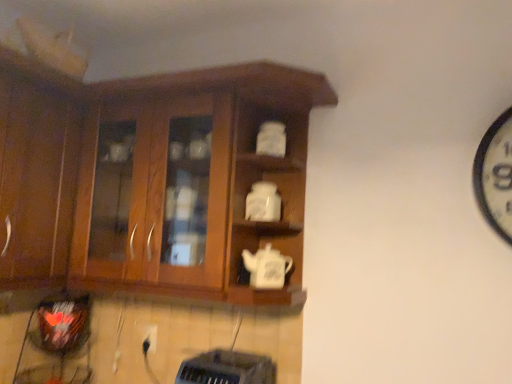
Question: Are wooden cabinet at left, arranged as the second cabinetry when viewed from the right, and white matte teapot at center, the 1th teapot from the bottom, located far from each other?

Choices:
 (A) yes
 (B) no

Answer: (B)

Question: Can you confirm if wooden cabinet at left, arranged as the second cabinetry when viewed from the right, is smaller than white matte teapot at center, the 2th teapot when ordered from top to bottom?

Choices:
 (A) no
 (B) yes

Answer: (A)

Question: Can you confirm if wooden cabinet at left, which appears as the first cabinetry when viewed from the left, is positioned to the right of white matte teapot at center, the 2th teapot when ordered from top to bottom?

Choices:
 (A) no
 (B) yes

Answer: (A)

Question: Does wooden cabinet at left, which appears as the first cabinetry when viewed from the left, turn towards white matte teapot at center, the 1th teapot from the bottom?

Choices:
 (A) yes
 (B) no

Answer: (A)

Question: From the image's perspective, does wooden cabinet at left, which appears as the first cabinetry when viewed from the left, appear higher than white matte teapot at center, the 1th teapot from the bottom?

Choices:
 (A) no
 (B) yes

Answer: (B)

Question: In the image, is white matte teapot at center, the 1th teapot from the bottom, positioned in front of or behind white matte teapot at center, placed as the 1th teapot when sorted from top to bottom?

Choices:
 (A) behind
 (B) front

Answer: (B)

Question: Is white matte teapot at center, the 2th teapot when ordered from top to bottom, to the left or to the right of white matte teapot at center, placed as the 1th teapot when sorted from top to bottom, in the image?

Choices:
 (A) left
 (B) right

Answer: (B)

Question: Is point (243, 253) closer or farther from the camera than point (272, 208)?

Choices:
 (A) closer
 (B) farther

Answer: (B)

Question: Would you say white matte teapot at center, the 2th teapot when ordered from top to bottom, is inside or outside white matte teapot at center, placed as the 1th teapot when sorted from top to bottom?

Choices:
 (A) inside
 (B) outside

Answer: (B)

Question: Considering the positions of wooden cabinet at left, which appears as the first cabinetry when viewed from the left, and wooden cabinet at center, which is the first cabinetry from right to left, in the image, is wooden cabinet at left, which appears as the first cabinetry when viewed from the left, taller or shorter than wooden cabinet at center, which is the first cabinetry from right to left,?

Choices:
 (A) short
 (B) tall

Answer: (A)

Question: Is point (23, 170) positioned closer to the camera than point (232, 211)?

Choices:
 (A) farther
 (B) closer

Answer: (A)

Question: From the image's perspective, is wooden cabinet at left, which appears as the first cabinetry when viewed from the left, located above or below wooden cabinet at center, which is the first cabinetry from right to left?

Choices:
 (A) below
 (B) above

Answer: (B)

Question: Is wooden cabinet at left, arranged as the second cabinetry when viewed from the right, bigger or smaller than wooden cabinet at center, the second cabinetry in the left-to-right sequence?

Choices:
 (A) small
 (B) big

Answer: (A)

Question: In terms of height, does white matte teapot at center, the 2th teapot ordered from the bottom, look taller or shorter compared to white matte teapot at center, the 2th teapot when ordered from top to bottom?

Choices:
 (A) tall
 (B) short

Answer: (A)

Question: Considering the relative positions of white matte teapot at center, placed as the 1th teapot when sorted from top to bottom, and white matte teapot at center, the 1th teapot from the bottom, in the image provided, is white matte teapot at center, placed as the 1th teapot when sorted from top to bottom, to the left or to the right of white matte teapot at center, the 1th teapot from the bottom,?

Choices:
 (A) right
 (B) left

Answer: (B)